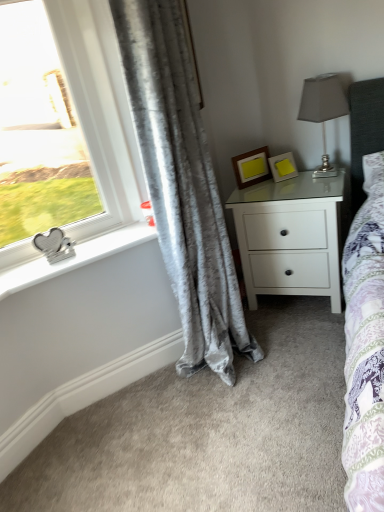
Find the location of a particular element. free point to the left of yellow matte picture frame at upper right, the first picture frame from the right is located at coordinates (266, 184).